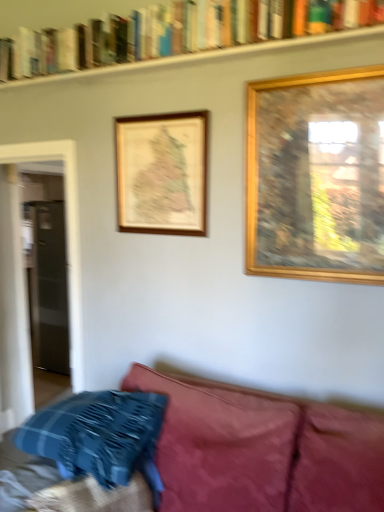
Question: From their relative heights in the image, would you say wooden map at upper center, the 1th picture frame in the back-to-front sequence, is taller or shorter than gold wooden picture frame at upper right, the 2th picture frame from the left?

Choices:
 (A) short
 (B) tall

Answer: (A)

Question: Is wooden map at upper center, the second picture frame viewed from the front, wider or thinner than gold wooden picture frame at upper right, arranged as the 2th picture frame when viewed from the back?

Choices:
 (A) wide
 (B) thin

Answer: (B)

Question: Which is farther from the clear glass door at left?

Choices:
 (A) wooden map at upper center, the 1th picture frame in the back-to-front sequence
 (B) gold wooden picture frame at upper right, the 2th picture frame from the left
 (C) blue plaid pillow at lower left
 (D) hardcover books at upper center

Answer: (B)

Question: Which object is the farthest from the blue plaid pillow at lower left?

Choices:
 (A) gold wooden picture frame at upper right, the 2th picture frame from the left
 (B) hardcover books at upper center
 (C) wooden map at upper center, the second picture frame viewed from the front
 (D) clear glass door at left

Answer: (D)